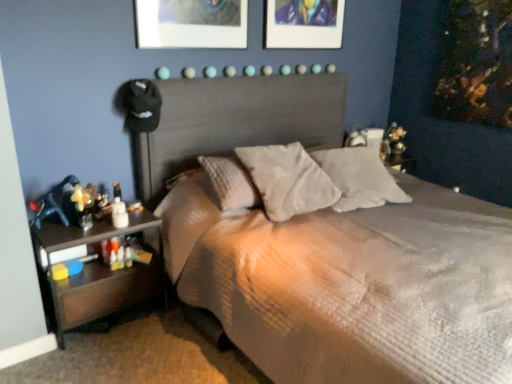
Question: From the image's perspective, is black wood nightstand at lower left on top of textured gray bed at center?

Choices:
 (A) no
 (B) yes

Answer: (A)

Question: From the image's perspective, is black wood nightstand at lower left located beneath textured gray bed at center?

Choices:
 (A) no
 (B) yes

Answer: (B)

Question: Considering the relative positions of black wood nightstand at lower left and textured gray bed at center in the image provided, is black wood nightstand at lower left in front of textured gray bed at center?

Choices:
 (A) yes
 (B) no

Answer: (B)

Question: Is black wood nightstand at lower left aimed at textured gray bed at center?

Choices:
 (A) yes
 (B) no

Answer: (B)

Question: Considering the relative positions of black wood nightstand at lower left and textured gray bed at center in the image provided, is black wood nightstand at lower left to the right of textured gray bed at center from the viewer's perspective?

Choices:
 (A) no
 (B) yes

Answer: (A)

Question: In terms of height, does textured gray bed at center look taller or shorter compared to metallic silver picture frame at upper center?

Choices:
 (A) short
 (B) tall

Answer: (B)

Question: Considering the positions of textured gray bed at center and metallic silver picture frame at upper center in the image, is textured gray bed at center wider or thinner than metallic silver picture frame at upper center?

Choices:
 (A) wide
 (B) thin

Answer: (A)

Question: From a real-world perspective, is textured gray bed at center physically located above or below metallic silver picture frame at upper center?

Choices:
 (A) below
 (B) above

Answer: (A)

Question: From the image's perspective, is textured gray bed at center above or below metallic silver picture frame at upper center?

Choices:
 (A) above
 (B) below

Answer: (B)

Question: In terms of size, does textured gray pillow at center, positioned as the second pillow in right-to-left order, appear bigger or smaller than white soft pillow at center, the second pillow viewed from the left?

Choices:
 (A) big
 (B) small

Answer: (A)

Question: Is textured gray pillow at center, positioned as the second pillow in right-to-left order, wider or thinner than white soft pillow at center, the second pillow viewed from the left?

Choices:
 (A) wide
 (B) thin

Answer: (B)

Question: In the image, is textured gray pillow at center, the first pillow when ordered from left to right, on the left side or the right side of white soft pillow at center, the second pillow viewed from the left?

Choices:
 (A) right
 (B) left

Answer: (B)

Question: Which is correct: textured gray pillow at center, the first pillow when ordered from left to right, is inside white soft pillow at center, the second pillow viewed from the left, or outside of it?

Choices:
 (A) outside
 (B) inside

Answer: (A)

Question: Is point (422, 369) positioned closer to the camera than point (333, 172)?

Choices:
 (A) farther
 (B) closer

Answer: (B)

Question: Considering the positions of textured gray bed at center and white soft pillow at center, which is the 1th pillow in right-to-left order, in the image, is textured gray bed at center wider or thinner than white soft pillow at center, which is the 1th pillow in right-to-left order,?

Choices:
 (A) thin
 (B) wide

Answer: (B)